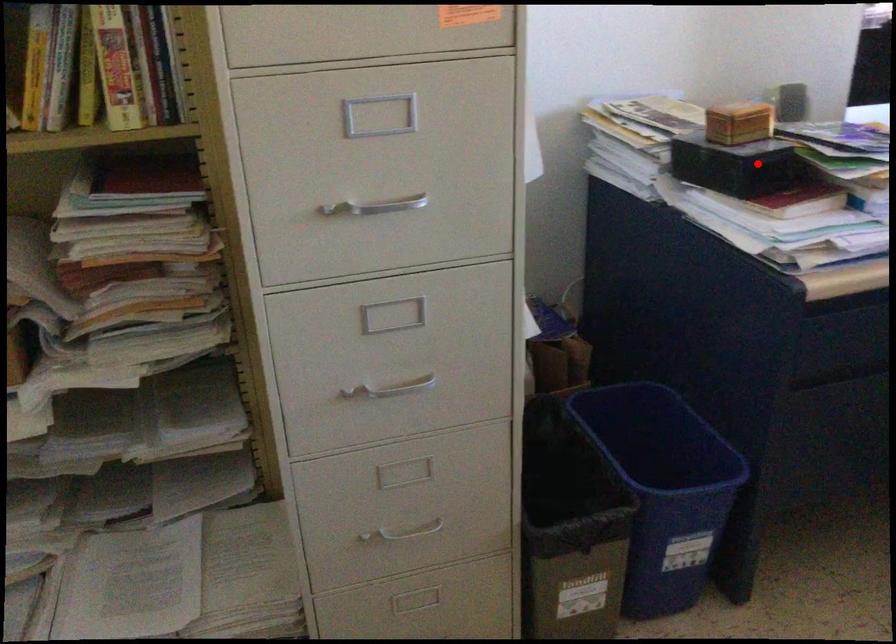
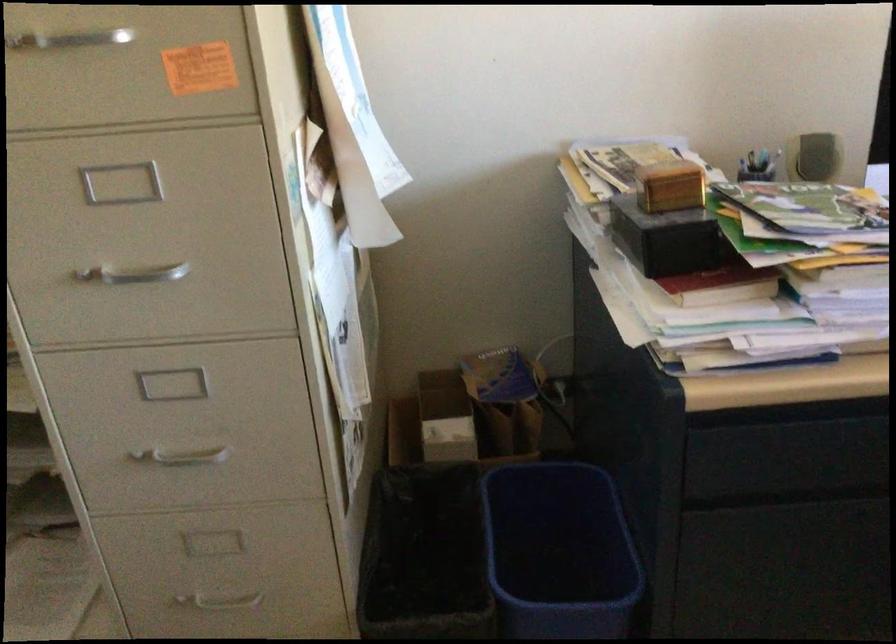
Question: A red point is marked in image1. In image2, is the corresponding 3D point closer to the camera or farther? Reply with the corresponding letter.

Choices:
 (A) The corresponding 3D point is closer.
 (B) The corresponding 3D point is farther.

Answer: (A)